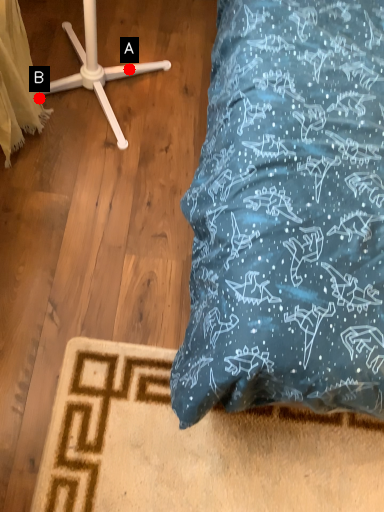
Question: Two points are circled on the image, labeled by A and B beside each circle. Among these points, which one is farthest from the camera?

Choices:
 (A) A is further
 (B) B is further

Answer: (A)